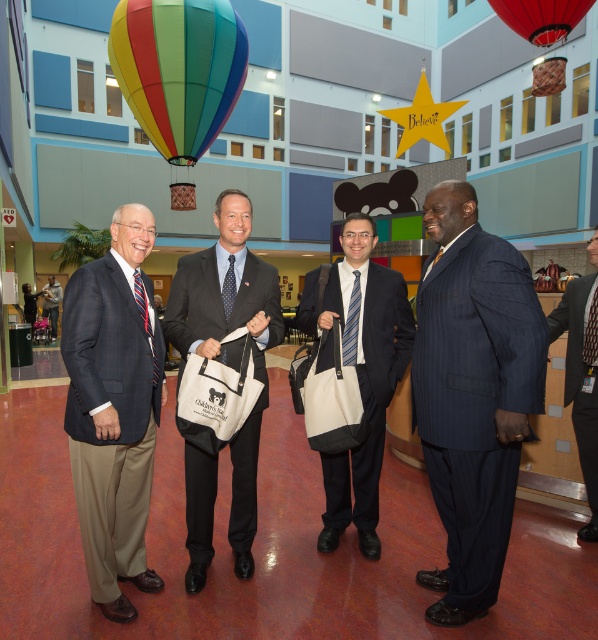
The height and width of the screenshot is (640, 598). Find the location of `matte white bag at center`. matte white bag at center is located at coordinates (358, 371).

Does matte white bag at center have a lesser height compared to matte black suit at center?

No.

The height and width of the screenshot is (640, 598). In order to click on matte white bag at center in this screenshot , I will do `click(358, 371)`.

Who is positioned more to the right, matte black bag at center or rainbow fabric balloon at upper left?

matte black bag at center is more to the right.

Can you confirm if matte black bag at center is taller than rainbow fabric balloon at upper left?

In fact, matte black bag at center may be shorter than rainbow fabric balloon at upper left.

Describe the element at coordinates (233, 342) in the screenshot. This screenshot has height=640, width=598. I see `matte black bag at center` at that location.

At what (x,y) coordinates should I click in order to perform the action: click on matte black bag at center. Please return your answer as a coordinate pair (x, y). The height and width of the screenshot is (640, 598). Looking at the image, I should click on (233, 342).

Who is taller, matte black bag at center or dark blue pinstripe suit at right?

Standing taller between the two is matte black bag at center.

Who is shorter, matte black bag at center or dark blue pinstripe suit at right?

With less height is dark blue pinstripe suit at right.

Between point (248, 208) and point (569, 328), which one is positioned in front?

Point (248, 208) is more forward.

Find the location of a particular element. This screenshot has width=598, height=640. matte black bag at center is located at coordinates (233, 342).